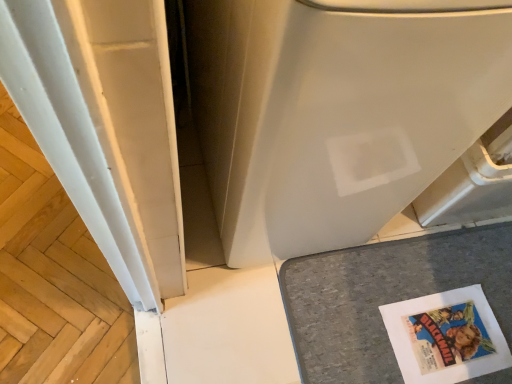
Question: From a real-world perspective, relative to white smooth wood at left, is white matte water heater at center vertically above or below?

Choices:
 (A) below
 (B) above

Answer: (B)

Question: Is point (488, 6) closer or farther from the camera than point (123, 370)?

Choices:
 (A) farther
 (B) closer

Answer: (B)

Question: Estimate the real-world distances between objects in this image. Which object is closer to the white smooth wood at left?

Choices:
 (A) gray felt mat at lower right
 (B) white matte water heater at center

Answer: (B)

Question: Estimate the real-world distances between objects in this image. Which object is closer to the white matte water heater at center?

Choices:
 (A) white smooth wood at left
 (B) gray felt mat at lower right

Answer: (B)